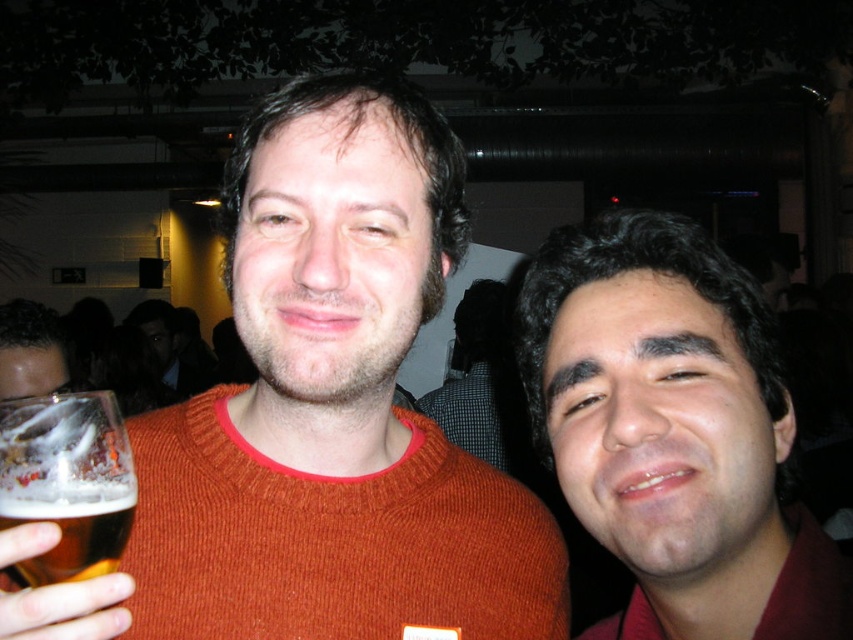
In the scene shown: Between orange knitted sweater at center and matte red shirt at right, which one appears on the right side from the viewer's perspective?

From the viewer's perspective, matte red shirt at right appears more on the right side.

You are a GUI agent. You are given a task and a screenshot of the screen. Output one action in this format:
    pyautogui.click(x=<x>, y=<y>)
    Task: Click on the orange knitted sweater at center
    
    Given the screenshot: What is the action you would take?
    pyautogui.click(x=323, y=413)

Does orange knitted sweater at center appear on the left side of translucent glass at left?

In fact, orange knitted sweater at center is to the right of translucent glass at left.

Which is in front, point (302, 509) or point (7, 528)?

Point (7, 528) is more forward.

Locate an element on the screen. orange knitted sweater at center is located at coordinates (323, 413).

Is point (769, 320) positioned before point (33, 557)?

No, it is behind (33, 557).

Is matte red shirt at right to the right of translucent glass at left from the viewer's perspective?

Indeed, matte red shirt at right is positioned on the right side of translucent glass at left.

Which is in front, point (624, 282) or point (102, 545)?

Point (102, 545) is more forward.

Locate an element on the screen. This screenshot has width=853, height=640. matte red shirt at right is located at coordinates (672, 432).